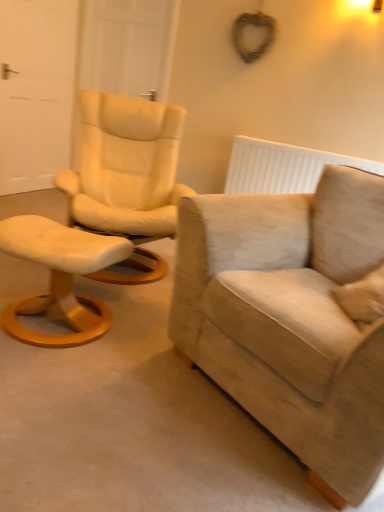
Identify the location of free location to the right of white fabric stool at left. (141, 349).